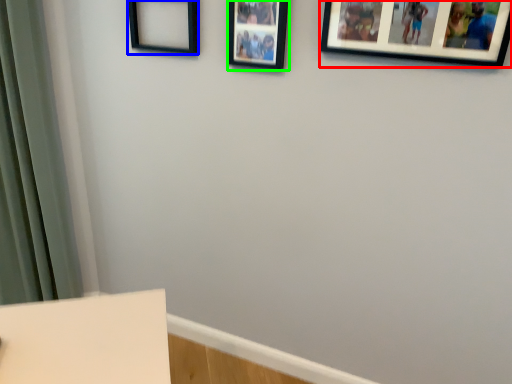
Question: Which object is the farthest from picture frame (highlighted by a red box)? Choose among these: picture frame (highlighted by a blue box) or picture frame (highlighted by a green box).

Choices:
 (A) picture frame
 (B) picture frame

Answer: (A)